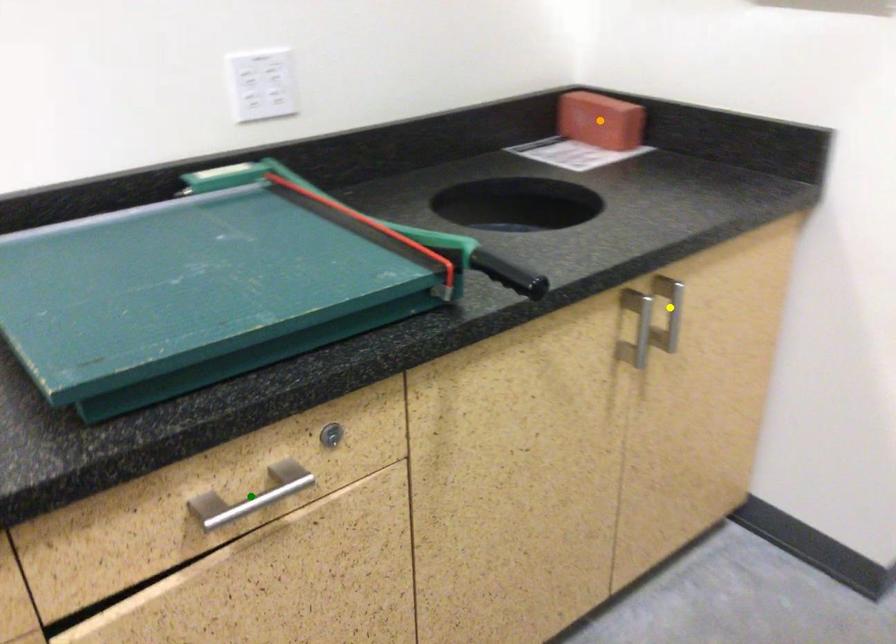
Based on the photo, order these from nearest to farthest:
1. orange point
2. green point
3. yellow point

green point
yellow point
orange point